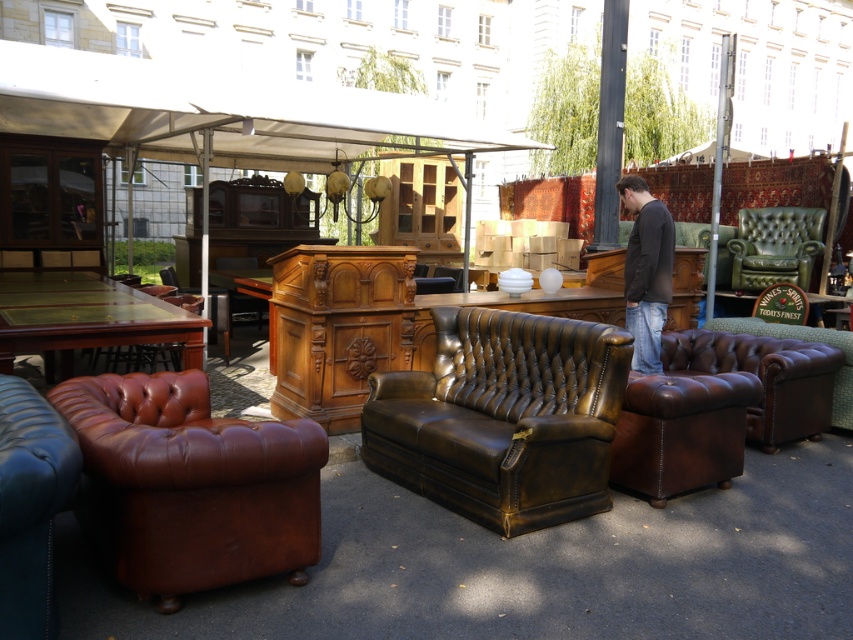
Does brown leather couch at center have a larger size compared to green fabric couch at right?

Correct, brown leather couch at center is larger in size than green fabric couch at right.

Is point (488, 497) farther from camera compared to point (839, 374)?

No, it is not.

Find the location of a particular element. This screenshot has width=853, height=640. brown leather couch at center is located at coordinates pos(503,417).

Is green fabric couch at right below brown leather armchair at center?

Correct, green fabric couch at right is located below brown leather armchair at center.

Does green fabric couch at right have a smaller size compared to brown leather armchair at center?

Actually, green fabric couch at right might be larger than brown leather armchair at center.

Is point (825, 339) farther from camera compared to point (453, 280)?

That is False.

What are the coordinates of `green fabric couch at right` in the screenshot? It's located at (804, 340).

Can you confirm if brown leather couch at center is positioned above dark gray sweater at center?

No, brown leather couch at center is not above dark gray sweater at center.

Does brown leather couch at center have a lesser height compared to dark gray sweater at center?

Yes, brown leather couch at center is shorter than dark gray sweater at center.

This screenshot has width=853, height=640. Describe the element at coordinates (503, 417) in the screenshot. I see `brown leather couch at center` at that location.

Locate an element on the screen. brown leather couch at center is located at coordinates (503, 417).